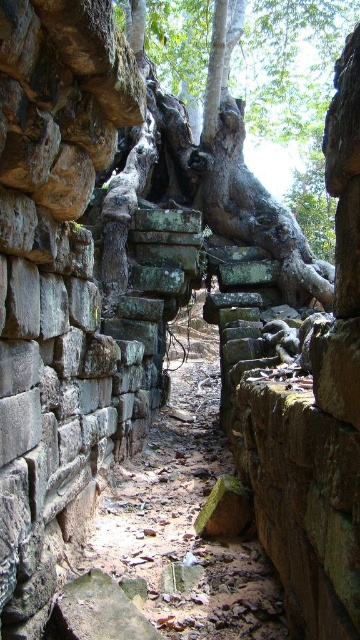
Question: Can you confirm if brown stone path at center is positioned above green rough bark tree at center?

Choices:
 (A) no
 (B) yes

Answer: (A)

Question: Which of the following is the farthest from the observer?

Choices:
 (A) green rough bark tree at center
 (B) brown stone path at center

Answer: (A)

Question: Considering the relative positions of brown stone path at center and green rough bark tree at center in the image provided, where is brown stone path at center located with respect to green rough bark tree at center?

Choices:
 (A) right
 (B) left

Answer: (B)

Question: Which point is farther from the camera taking this photo?

Choices:
 (A) (254, 220)
 (B) (181, 612)

Answer: (A)

Question: Is brown stone path at center to the left of green rough bark tree at center from the viewer's perspective?

Choices:
 (A) yes
 (B) no

Answer: (A)